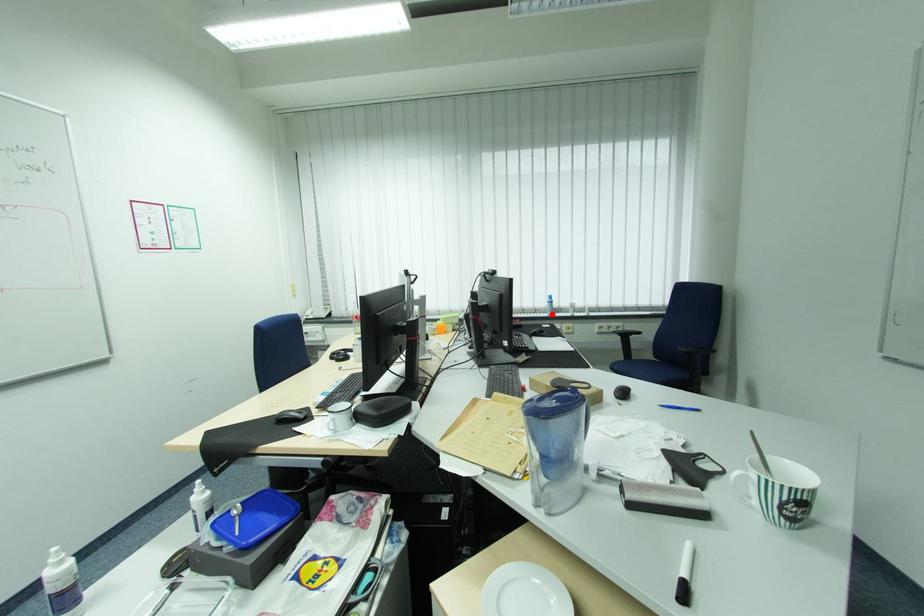
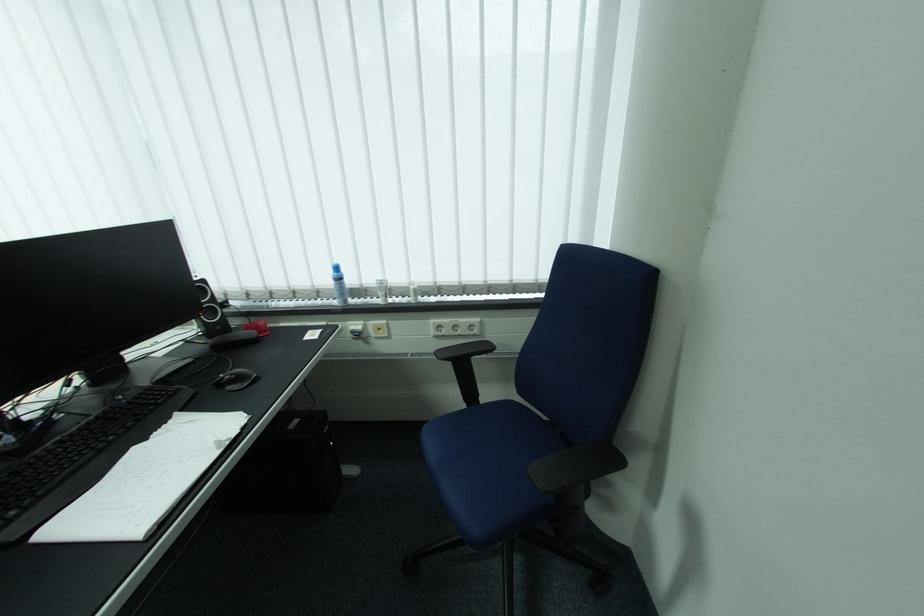
Locate, in the second image, the point that corresponds to the highlighted location in the first image.

(342, 302)